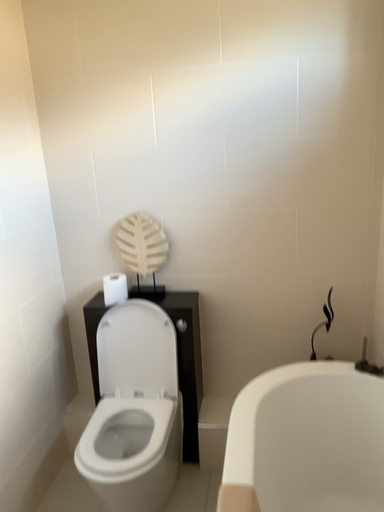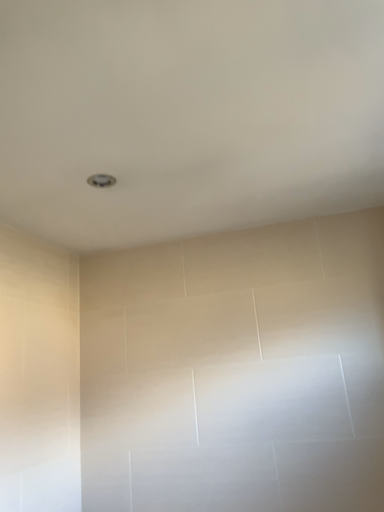
Question: Which way did the camera rotate in the video?

Choices:
 (A) rotated upward
 (B) rotated downward

Answer: (A)